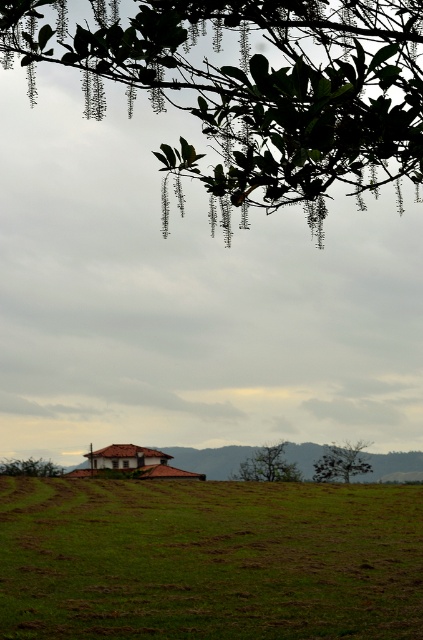
Question: Which of the following is the farthest from the observer?

Choices:
 (A) (414, 61)
 (B) (348, 467)
 (C) (24, 460)

Answer: (B)

Question: Among these objects, which one is farthest from the camera?

Choices:
 (A) brown clay house at lower center
 (B) green grassy field at lower center
 (C) green matte tree at center

Answer: (A)

Question: Can you confirm if green leafy branches at upper center is positioned below green leafy tree at lower left?

Choices:
 (A) yes
 (B) no

Answer: (B)

Question: Which point is farther to the camera?

Choices:
 (A) green leafy tree at lower right
 (B) green matte tree at center

Answer: (A)

Question: Can you confirm if brown clay house at lower center is smaller than green matte tree at center?

Choices:
 (A) yes
 (B) no

Answer: (B)

Question: Does green matte tree at center have a lesser width compared to green leafy tree at lower left?

Choices:
 (A) yes
 (B) no

Answer: (B)